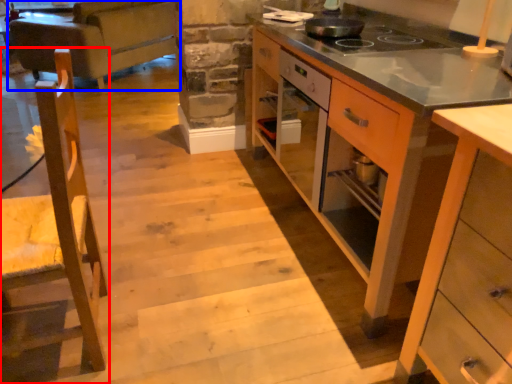
Question: Which of the following is the farthest to the observer, chair (highlighted by a red box) or studio couch (highlighted by a blue box)?

Choices:
 (A) chair
 (B) studio couch

Answer: (B)